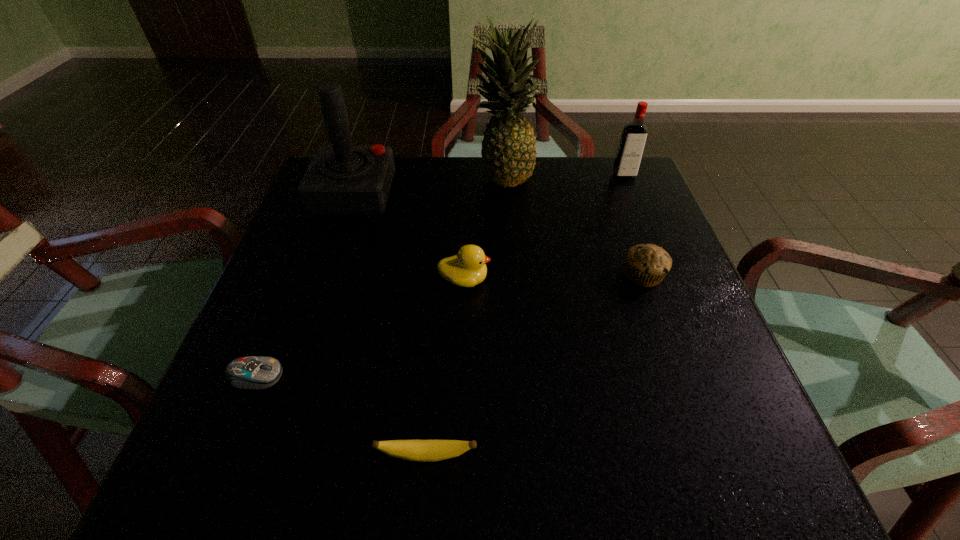
This screenshot has width=960, height=540. In order to click on pineapple in this screenshot , I will do `click(508, 152)`.

The height and width of the screenshot is (540, 960). What are the coordinates of `joystick` in the screenshot? It's located at (342, 179).

In order to click on the fifth shortest object in this screenshot , I will do `click(633, 139)`.

Where is `the fourth shortest object`? The width and height of the screenshot is (960, 540). the fourth shortest object is located at coordinates (466, 269).

I want to click on muffin, so click(646, 265).

Locate an element on the screen. the nearest object is located at coordinates (413, 450).

I want to click on the second shortest object, so click(413, 450).

At what (x,y) coordinates should I click in order to perform the action: click on the shortest object. Please return your answer as a coordinate pair (x, y). This screenshot has width=960, height=540. Looking at the image, I should click on (248, 372).

You are a GUI agent. You are given a task and a screenshot of the screen. Output one action in this format:
    pyautogui.click(x=<x>, y=<y>)
    Task: Click on the computer mouse
    The image size is (960, 540).
    Given the screenshot: What is the action you would take?
    pyautogui.click(x=248, y=372)

Identify the location of vacant point located 0.280m on the left of the tallest object. The image size is (960, 540). (362, 174).